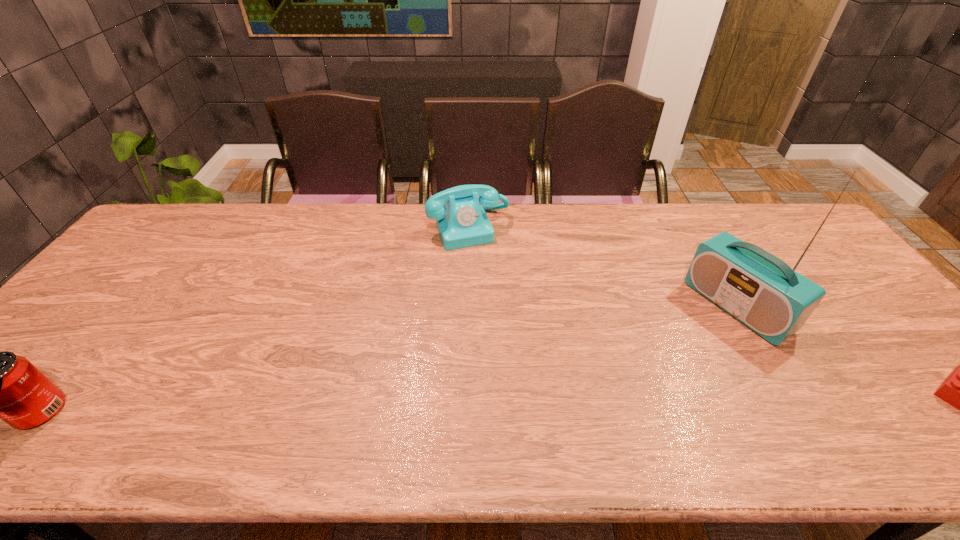
This screenshot has height=540, width=960. In order to click on vacant space on the desktop that is between the soda can and the Lego and is positioned on the dial of the farthest object in this screenshot , I will do `click(542, 400)`.

You are a GUI agent. You are given a task and a screenshot of the screen. Output one action in this format:
    pyautogui.click(x=<x>, y=<y>)
    Task: Click on the free space on the desktop that is between the leftmost object and the rightmost object and is positioned on the front panel of the tallest object
    This screenshot has height=540, width=960.
    Given the screenshot: What is the action you would take?
    594,399